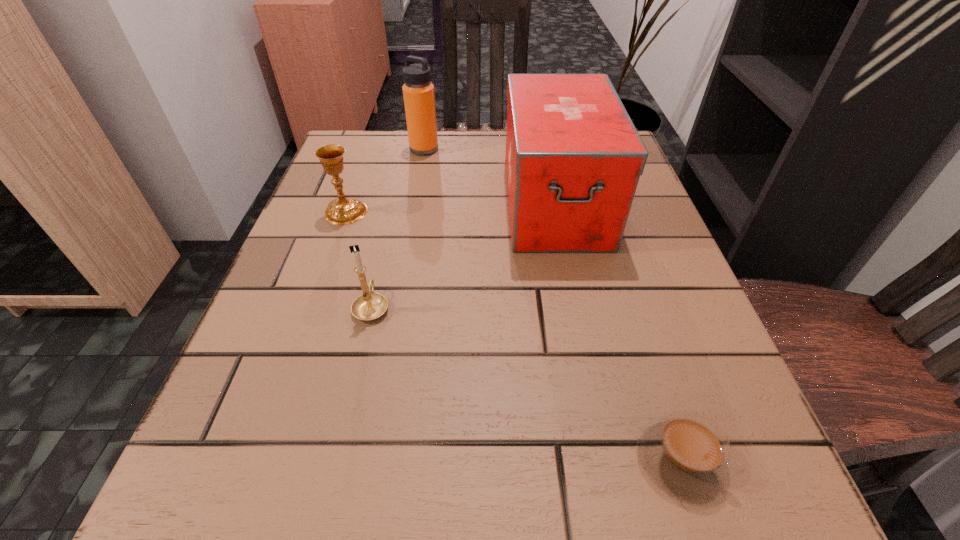
Where is `the farthest object`? the farthest object is located at coordinates (418, 92).

Where is `the first-aid kit`? Image resolution: width=960 pixels, height=540 pixels. the first-aid kit is located at coordinates (573, 159).

Find the location of `the fourth farthest object`. the fourth farthest object is located at coordinates (369, 306).

At what (x,y) coordinates should I click in order to perform the action: click on chalice. Please return your answer as a coordinate pair (x, y). The image size is (960, 540). Looking at the image, I should click on pos(341,211).

Locate an element on the screen. the nearest object is located at coordinates (685, 454).

This screenshot has height=540, width=960. In order to click on the shortest object in this screenshot , I will do `click(685, 454)`.

The width and height of the screenshot is (960, 540). Find the location of `vacant position located on the right of the farthest object`. vacant position located on the right of the farthest object is located at coordinates (576, 149).

Locate an element on the screen. free location located on the handle side of the first-aid kit is located at coordinates (571, 285).

Locate an element on the screen. The width and height of the screenshot is (960, 540). free space located on the handle side of the candle holder is located at coordinates (381, 265).

At what (x,y) coordinates should I click in order to perform the action: click on vacant region located 0.210m on the handle side of the candle holder. Please return your answer as a coordinate pair (x, y). Looking at the image, I should click on coord(393,213).